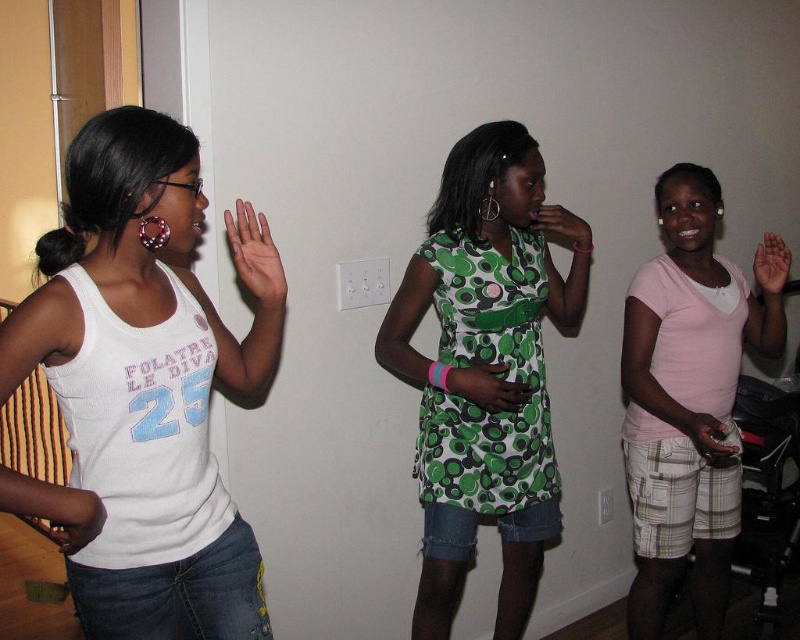
Question: Which object appears closest to the camera in this image?

Choices:
 (A) green dotted dress at center
 (B) pink cotton shirt at right
 (C) green fabric hand at center
 (D) matte black controller at lower right

Answer: (D)

Question: In this image, where is green printed dress at center located relative to white matte hand at lower left?

Choices:
 (A) right
 (B) left

Answer: (A)

Question: Which of the following is the farthest from the observer?

Choices:
 (A) (454, 376)
 (B) (276, 257)
 (C) (672, 394)
 (D) (574, 237)

Answer: (D)

Question: Considering the real-world distances, which object is closest to the pink smooth palm at center?

Choices:
 (A) white matte hand at center
 (B) green fabric hand at center
 (C) white ribbed tank top at left
 (D) green dotted dress at center

Answer: (B)

Question: Does green printed dress at center have a smaller size compared to pink smooth palm at center?

Choices:
 (A) no
 (B) yes

Answer: (A)

Question: Can you confirm if white ribbed tank top at left is positioned below green printed dress at center?

Choices:
 (A) yes
 (B) no

Answer: (B)